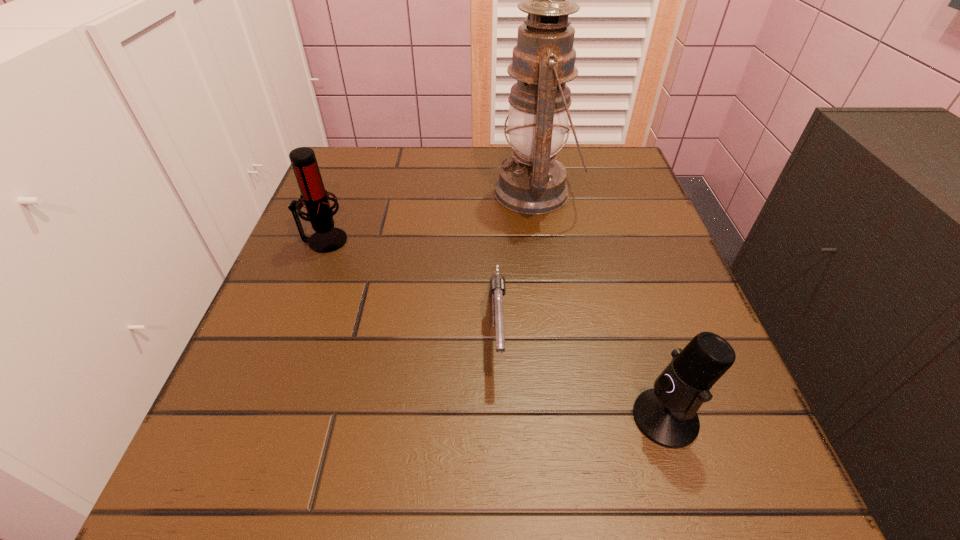
What are the coordinates of `the tallest object` in the screenshot? It's located at (533, 182).

Identify the location of oil lamp. (533, 182).

Find the location of a particular element. the leftmost object is located at coordinates [x=326, y=238].

Identify the location of the second farthest object. Image resolution: width=960 pixels, height=540 pixels. (326, 238).

This screenshot has height=540, width=960. In order to click on the right microphone in this screenshot , I will do `click(667, 415)`.

Where is `the second shortest object`? the second shortest object is located at coordinates (667, 415).

At what (x,y) coordinates should I click in order to perform the action: click on the third farthest object. Please return your answer as a coordinate pair (x, y). Looking at the image, I should click on (497, 290).

You are a GUI agent. You are given a task and a screenshot of the screen. Output one action in this format:
    pyautogui.click(x=<x>, y=<y>)
    Task: Click on the gun
    The width and height of the screenshot is (960, 540).
    Given the screenshot: What is the action you would take?
    pyautogui.click(x=497, y=290)

Identify the location of vacant space situated on the left of the tallest object. (395, 193).

The image size is (960, 540). I want to click on vacant space located 0.230m on the back of the farther microphone, so click(351, 170).